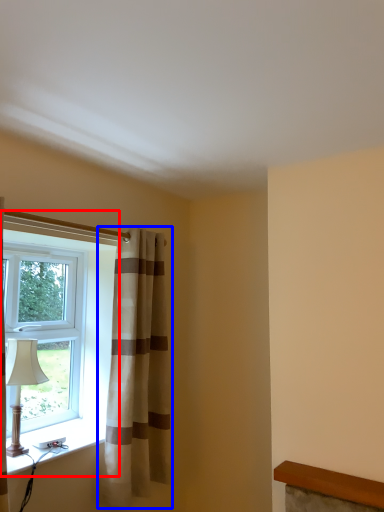
Question: Among these objects, which one is farthest to the camera, window (highlighted by a red box) or curtain (highlighted by a blue box)?

Choices:
 (A) window
 (B) curtain

Answer: (A)